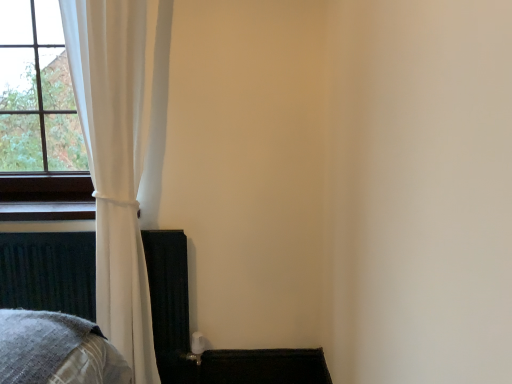
Question: From the image's perspective, relative to white fabric curtain at left, is metallic dark gray bed frame at lower left above or below?

Choices:
 (A) above
 (B) below

Answer: (B)

Question: From a real-world perspective, is metallic dark gray bed frame at lower left physically located above or below white fabric curtain at left?

Choices:
 (A) below
 (B) above

Answer: (A)

Question: Considering their positions, is metallic dark gray bed frame at lower left located in front of or behind white fabric curtain at left?

Choices:
 (A) front
 (B) behind

Answer: (B)

Question: Considering the positions of point (118, 29) and point (29, 281), is point (118, 29) closer or farther from the camera than point (29, 281)?

Choices:
 (A) farther
 (B) closer

Answer: (B)

Question: Is white fabric curtain at left taller or shorter than metallic dark gray bed frame at lower left?

Choices:
 (A) short
 (B) tall

Answer: (B)

Question: From the image's perspective, is white fabric curtain at left located above or below metallic dark gray bed frame at lower left?

Choices:
 (A) above
 (B) below

Answer: (A)

Question: Is white fabric curtain at left in front of or behind metallic dark gray bed frame at lower left in the image?

Choices:
 (A) front
 (B) behind

Answer: (A)